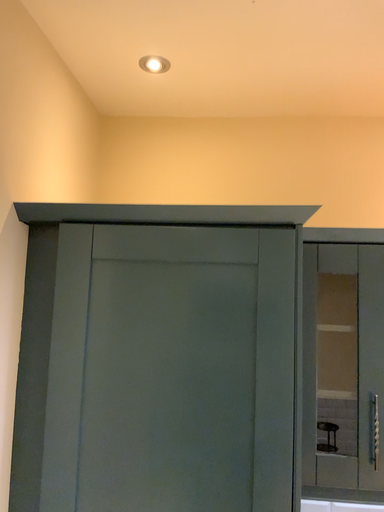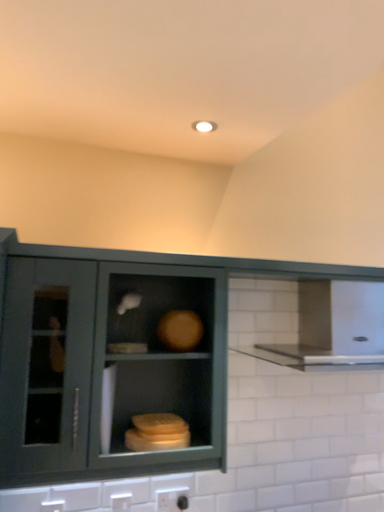
Question: How did the camera likely rotate when shooting the video?

Choices:
 (A) rotated left
 (B) rotated right

Answer: (B)